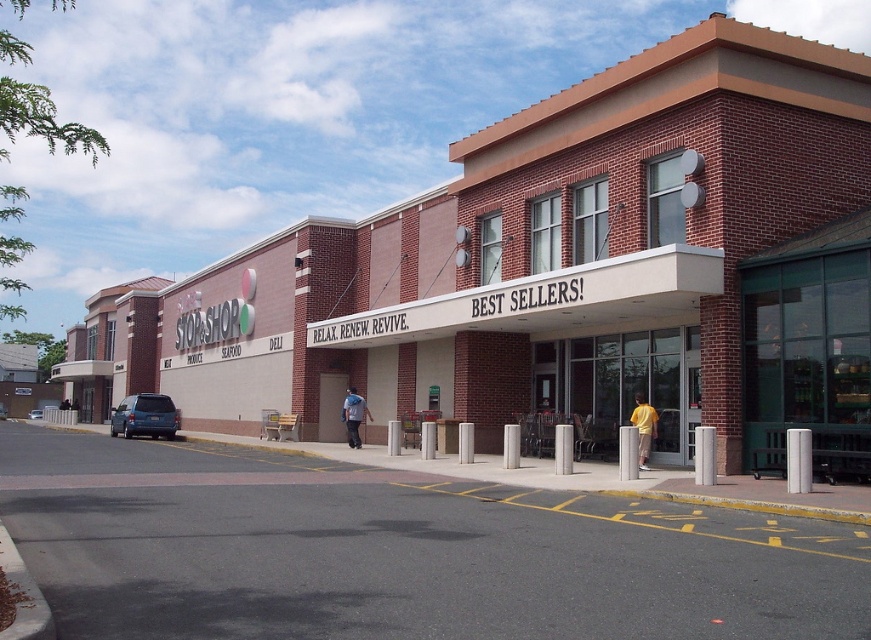
Who is more distant from viewer, (159,413) or (343,401)?

The point (159,413) is behind.

Which is more to the right, matte blue suv at left or blue denim jacket at center?

Positioned to the right is blue denim jacket at center.

Where is `matte blue suv at left`? This screenshot has width=871, height=640. matte blue suv at left is located at coordinates (144, 417).

Can you confirm if yellow cotton shirt at center is taller than blue denim jacket at center?

Incorrect, yellow cotton shirt at center's height is not larger of blue denim jacket at center's.

Where is `yellow cotton shirt at center`? The width and height of the screenshot is (871, 640). yellow cotton shirt at center is located at coordinates (643, 428).

Locate an element on the screen. This screenshot has height=640, width=871. yellow cotton shirt at center is located at coordinates (643, 428).

Is matte blue suv at left thinner than yellow cotton shirt at center?

Incorrect, matte blue suv at left's width is not less than yellow cotton shirt at center's.

You are a GUI agent. You are given a task and a screenshot of the screen. Output one action in this format:
    pyautogui.click(x=<x>, y=<y>)
    Task: Click on the matte blue suv at left
    
    Given the screenshot: What is the action you would take?
    pyautogui.click(x=144, y=417)

Who is more forward, (159,428) or (646,420)?

Point (646,420) is in front.

Identify the location of matte blue suv at left. (144, 417).